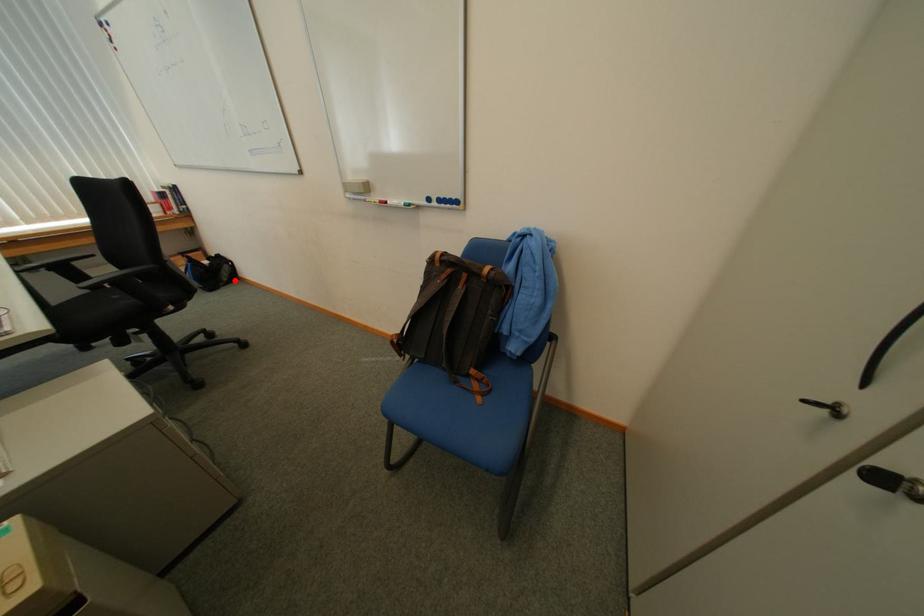
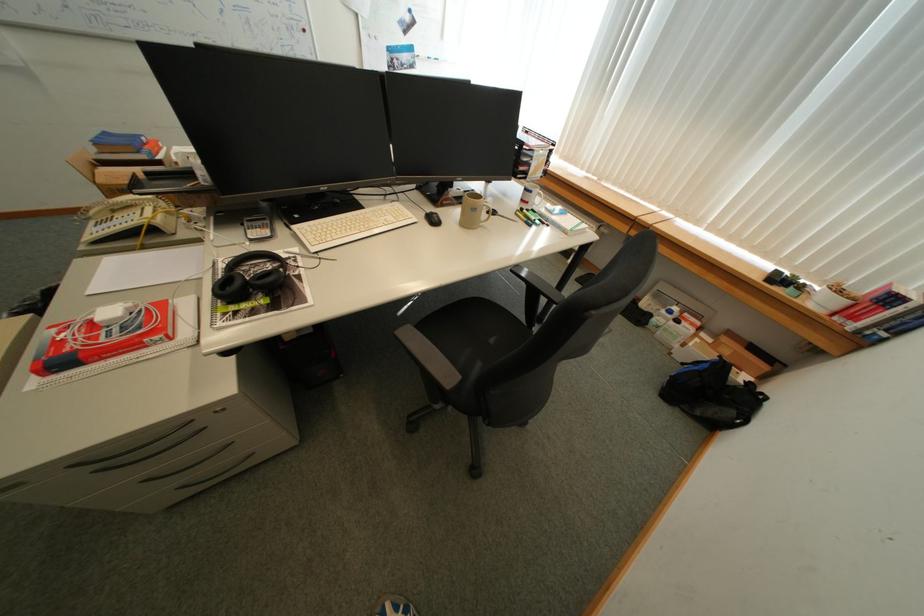
Find the pixel in the second image that matches the highlighted location in the first image.

(708, 415)